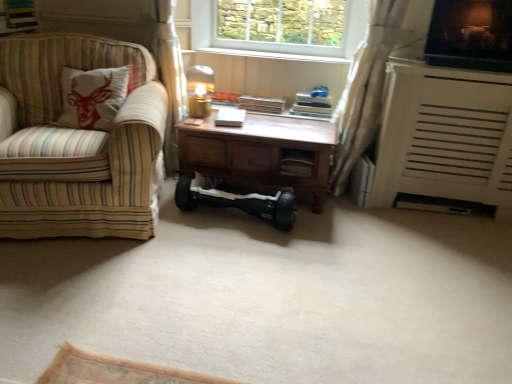
You are a GUI agent. You are given a task and a screenshot of the screen. Output one action in this format:
    pyautogui.click(x=<x>, y=<y>)
    Task: Click on the free point to the right of black rubber hoverboard at center
    
    Given the screenshot: What is the action you would take?
    pyautogui.click(x=335, y=236)